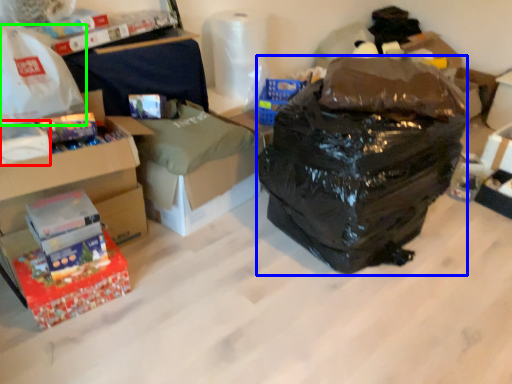
Question: Based on their relative distances, which object is nearer to box (highlighted by a red box)? Choose from garbage (highlighted by a blue box) and plastic bag (highlighted by a green box).

Choices:
 (A) garbage
 (B) plastic bag

Answer: (B)